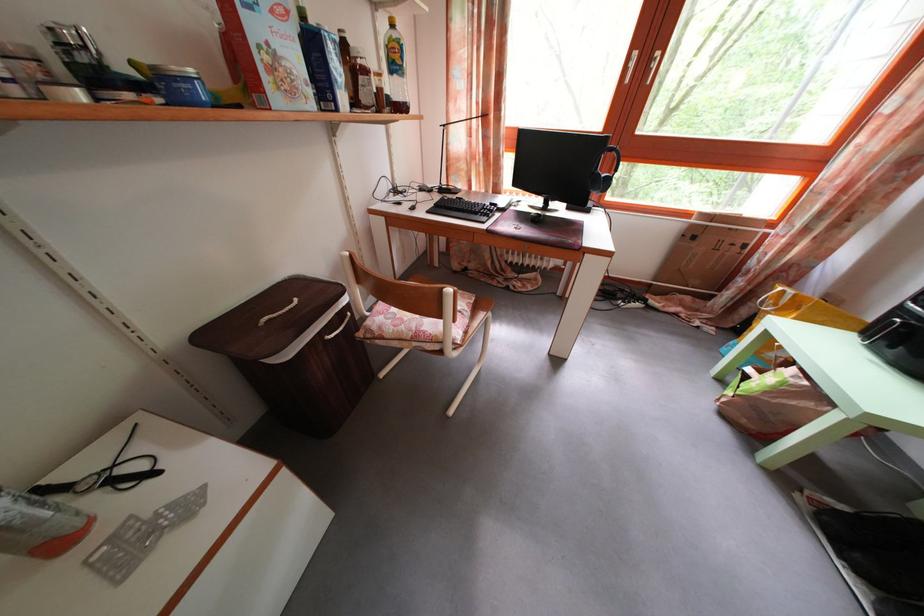
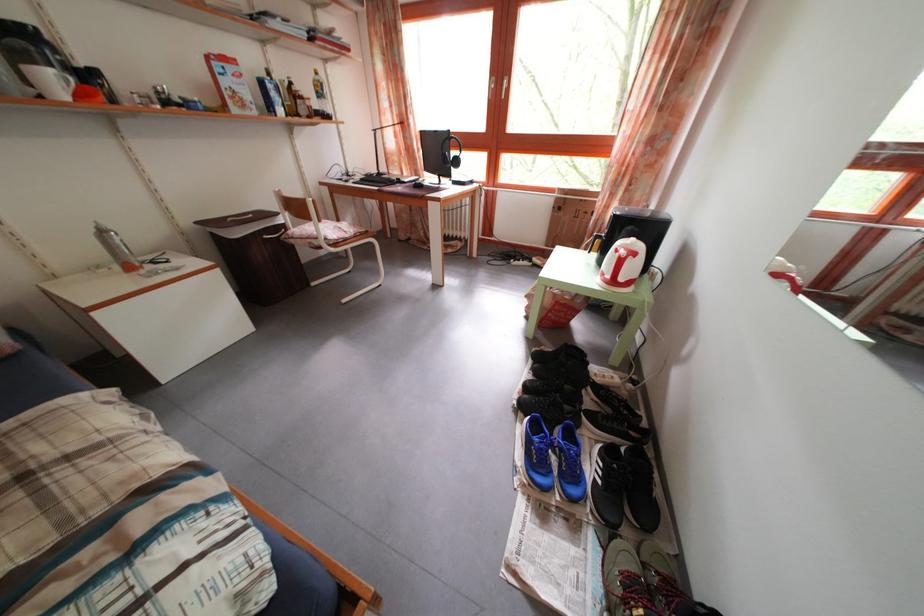
In the second image, find the point that corresponds to point (481, 196) in the first image.

(412, 182)